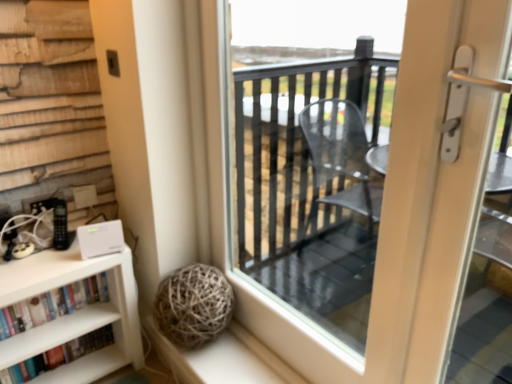
Question: Considering the relative sizes of transparent glass door at center and white matte bookshelf at lower left, positioned as the second book in bottom-to-top order, in the image provided, is transparent glass door at center bigger than white matte bookshelf at lower left, positioned as the second book in bottom-to-top order,?

Choices:
 (A) no
 (B) yes

Answer: (B)

Question: Would you say transparent glass door at center is outside white matte bookshelf at lower left, positioned as the 1th book in top-to-bottom order?

Choices:
 (A) no
 (B) yes

Answer: (B)

Question: From a real-world perspective, is transparent glass door at center on top of white matte bookshelf at lower left, positioned as the second book in bottom-to-top order?

Choices:
 (A) no
 (B) yes

Answer: (B)

Question: From the image's perspective, does transparent glass door at center appear lower than white matte bookshelf at lower left, positioned as the second book in bottom-to-top order?

Choices:
 (A) no
 (B) yes

Answer: (A)

Question: Is transparent glass door at center further to camera compared to white matte bookshelf at lower left, positioned as the second book in bottom-to-top order?

Choices:
 (A) no
 (B) yes

Answer: (A)

Question: Considering the relative positions of hardcover books at lower left, which ranks as the first book in bottom-to-top order, and white matte bookshelf at lower left, positioned as the 1th book in top-to-bottom order, in the image provided, is hardcover books at lower left, which ranks as the first book in bottom-to-top order, to the left or to the right of white matte bookshelf at lower left, positioned as the 1th book in top-to-bottom order,?

Choices:
 (A) left
 (B) right

Answer: (A)

Question: Is hardcover books at lower left, placed as the second book when sorted from top to bottom, in front of or behind white matte bookshelf at lower left, positioned as the 1th book in top-to-bottom order, in the image?

Choices:
 (A) behind
 (B) front

Answer: (A)

Question: Which is correct: hardcover books at lower left, placed as the second book when sorted from top to bottom, is inside white matte bookshelf at lower left, positioned as the second book in bottom-to-top order, or outside of it?

Choices:
 (A) inside
 (B) outside

Answer: (B)

Question: From a real-world perspective, is hardcover books at lower left, placed as the second book when sorted from top to bottom, positioned above or below white matte bookshelf at lower left, positioned as the second book in bottom-to-top order?

Choices:
 (A) below
 (B) above

Answer: (A)

Question: Based on their positions, is transparent glass door at center located to the left or right of white matte bookshelf at lower left, positioned as the 1th book in top-to-bottom order?

Choices:
 (A) right
 (B) left

Answer: (A)

Question: In the image, is transparent glass door at center positioned in front of or behind white matte bookshelf at lower left, positioned as the second book in bottom-to-top order?

Choices:
 (A) behind
 (B) front

Answer: (B)

Question: Considering the positions of point (488, 130) and point (15, 321), is point (488, 130) closer or farther from the camera than point (15, 321)?

Choices:
 (A) closer
 (B) farther

Answer: (A)

Question: From the image's perspective, is transparent glass door at center located above or below white matte bookshelf at lower left, positioned as the second book in bottom-to-top order?

Choices:
 (A) above
 (B) below

Answer: (A)

Question: Is white matte bookshelf at lower left, positioned as the 1th book in top-to-bottom order, bigger or smaller than transparent glass door at center?

Choices:
 (A) big
 (B) small

Answer: (B)

Question: From a real-world perspective, is white matte bookshelf at lower left, positioned as the second book in bottom-to-top order, above or below transparent glass door at center?

Choices:
 (A) above
 (B) below

Answer: (B)